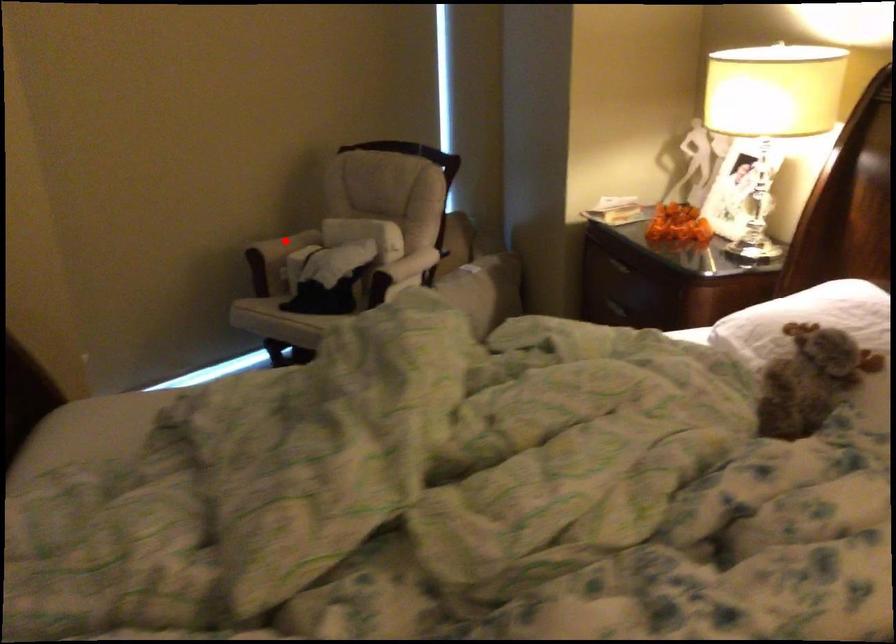
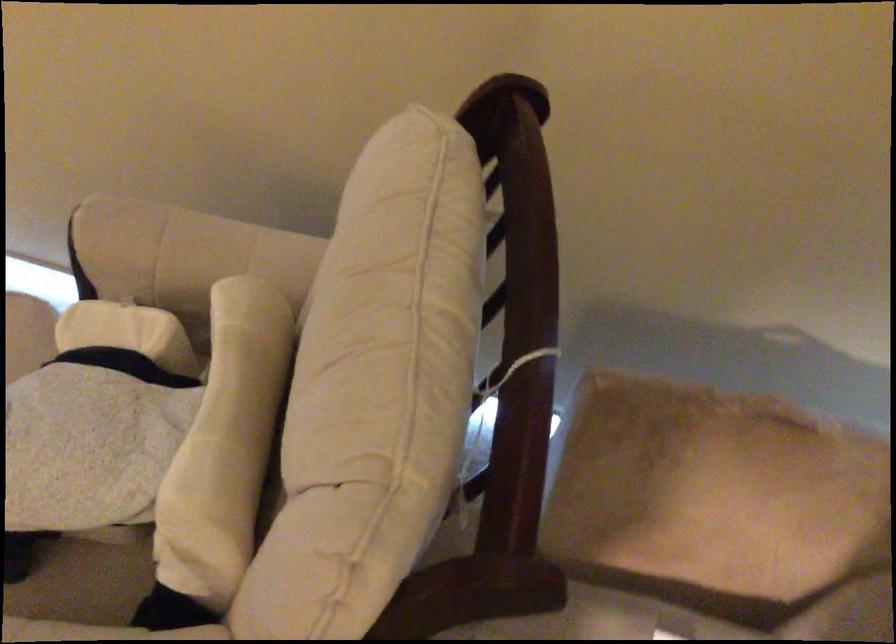
Find the pixel in the second image that matches the highlighted location in the first image.

(181, 250)